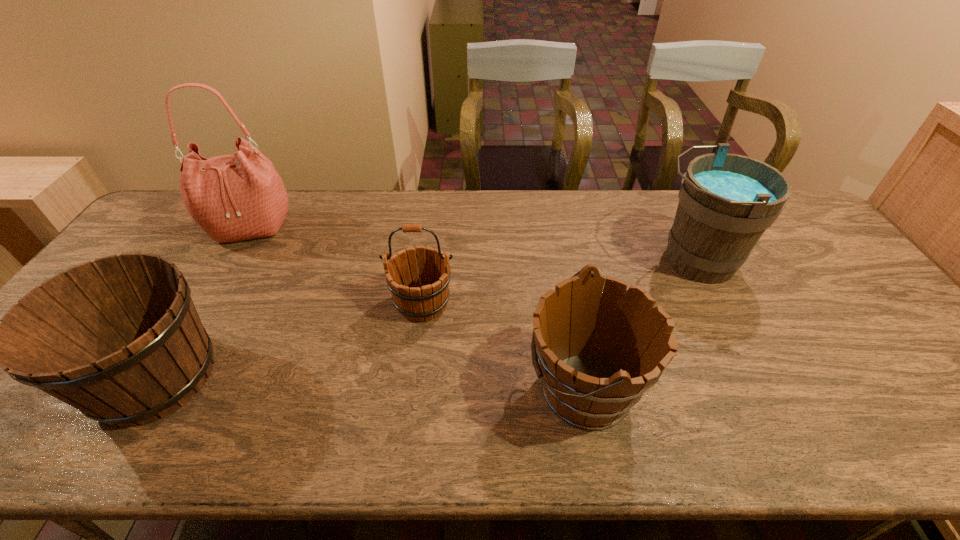
Locate an element on the screen. The height and width of the screenshot is (540, 960). wine bucket object that ranks as the closest to the rightmost wine bucket is located at coordinates tap(596, 362).

This screenshot has height=540, width=960. I want to click on the third closest wine bucket relative to the third wine bucket from left to right, so pos(119,338).

Locate an element on the screen. free space that satisfies the following two spatial constraints: 1. with a handle on the side of the rightmost wine bucket; 2. on the front side of the third object from right to left is located at coordinates (715, 303).

Locate an element on the screen. vacant space that satisfies the following two spatial constraints: 1. on the back side of the leftmost wine bucket; 2. on the left side of the third object from left to right is located at coordinates (200, 303).